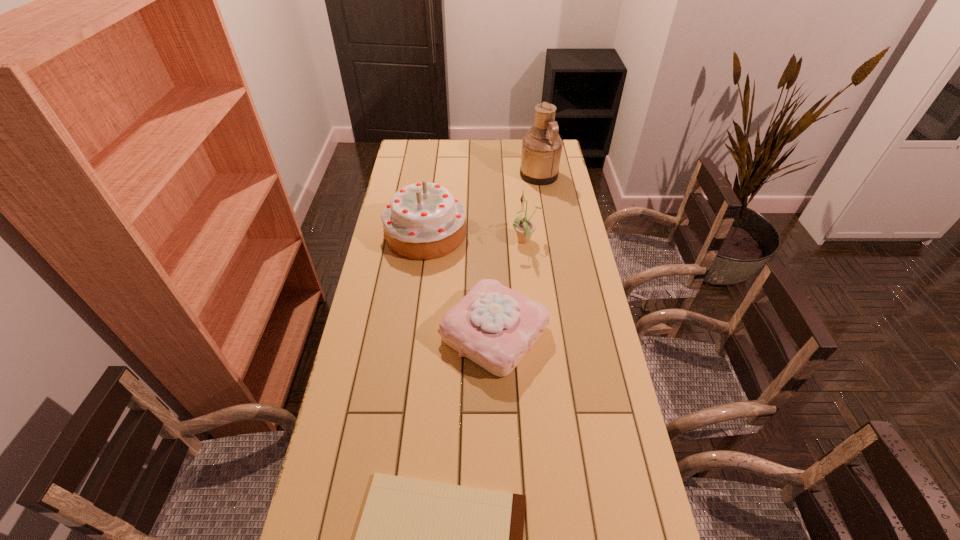
The image size is (960, 540). Identify the location of free space located 0.260m on the right of the taller cake. (533, 233).

What are the coordinates of `vacant space located on the right of the nearer cake` in the screenshot? It's located at (590, 333).

This screenshot has height=540, width=960. I want to click on object situated at the far edge, so pos(541,147).

I want to click on object situated at the left edge, so click(422, 221).

This screenshot has width=960, height=540. Identify the location of object positioned at the right edge. (541, 147).

Locate an element on the screen. This screenshot has height=540, width=960. object located in the far right corner section of the desktop is located at coordinates (541, 147).

Identify the location of vacant region at the far edge of the desktop. The image size is (960, 540). (501, 147).

Image resolution: width=960 pixels, height=540 pixels. In the image, there is a desktop. Identify the location of vacant area at the left edge. (364, 299).

The image size is (960, 540). What are the coordinates of `vacant space at the right edge of the desktop` in the screenshot? It's located at (558, 288).

This screenshot has width=960, height=540. Find the location of `empty location between the sunflower and the pitcher`. empty location between the sunflower and the pitcher is located at coordinates (532, 208).